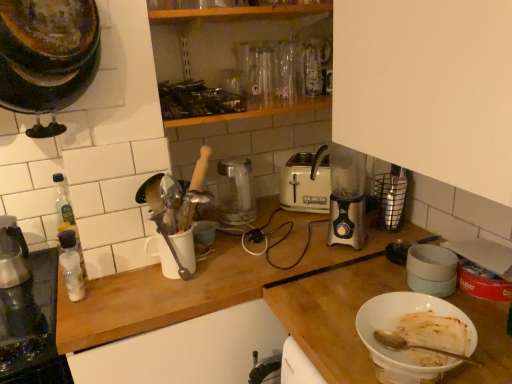
Locate an element on the screen. This screenshot has height=384, width=512. free space between white plastic toaster at center and satin silver kettle at center, the 3th kitchen appliance viewed from the front is located at coordinates (276, 211).